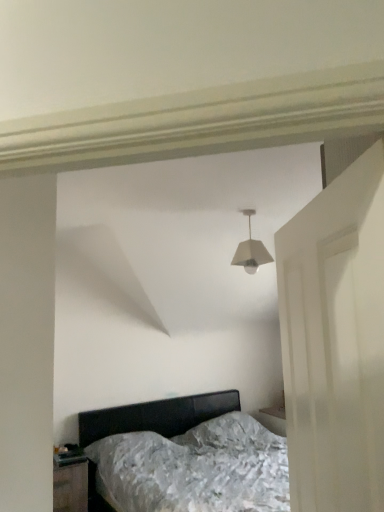
Question: From the image's perspective, is metallic silver bed at center on top of black glossy nightstand at lower left?

Choices:
 (A) no
 (B) yes

Answer: (B)

Question: Can you confirm if metallic silver bed at center is positioned to the left of black glossy nightstand at lower left?

Choices:
 (A) no
 (B) yes

Answer: (A)

Question: Is metallic silver bed at center taller than black glossy nightstand at lower left?

Choices:
 (A) no
 (B) yes

Answer: (B)

Question: Is metallic silver bed at center not close to black glossy nightstand at lower left?

Choices:
 (A) yes
 (B) no

Answer: (B)

Question: Is metallic silver bed at center at the right side of black glossy nightstand at lower left?

Choices:
 (A) yes
 (B) no

Answer: (A)

Question: From a real-world perspective, is metallic silver bed at center over black glossy nightstand at lower left?

Choices:
 (A) yes
 (B) no

Answer: (A)

Question: Is white matte door at right to the right of white matte lampshade at center from the viewer's perspective?

Choices:
 (A) no
 (B) yes

Answer: (A)

Question: Is there a large distance between white matte door at right and white matte lampshade at center?

Choices:
 (A) no
 (B) yes

Answer: (B)

Question: Can you confirm if white matte door at right is taller than white matte lampshade at center?

Choices:
 (A) no
 (B) yes

Answer: (B)

Question: Is white matte door at right behind white matte lampshade at center?

Choices:
 (A) no
 (B) yes

Answer: (A)

Question: Is white matte door at right in front of white matte lampshade at center?

Choices:
 (A) yes
 (B) no

Answer: (A)

Question: Is white matte door at right to the left of white matte lampshade at center from the viewer's perspective?

Choices:
 (A) yes
 (B) no

Answer: (A)

Question: Is the surface of white matte lampshade at center in direct contact with metallic silver bed at center?

Choices:
 (A) yes
 (B) no

Answer: (B)